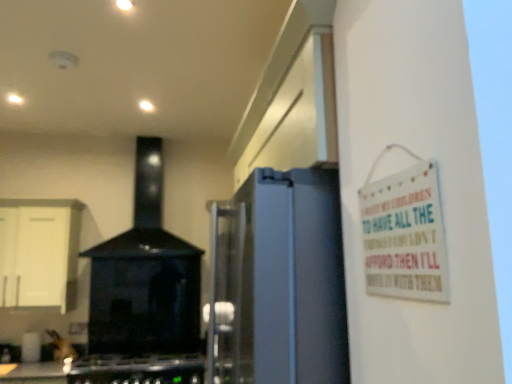
Question: In the image, is white wooden sign at upper right positioned in front of or behind white matte cabinet at left?

Choices:
 (A) front
 (B) behind

Answer: (A)

Question: Considering the positions of point (434, 248) and point (26, 248), is point (434, 248) closer or farther from the camera than point (26, 248)?

Choices:
 (A) farther
 (B) closer

Answer: (B)

Question: Which object is the farthest from the white wooden sign at upper right?

Choices:
 (A) white matte cabinet at left
 (B) black glossy stove at center
 (C) black matte gas stove at lower left

Answer: (B)

Question: Which is nearer to the black matte gas stove at lower left?

Choices:
 (A) white wooden sign at upper right
 (B) black glossy stove at center
 (C) white matte cabinet at left

Answer: (B)